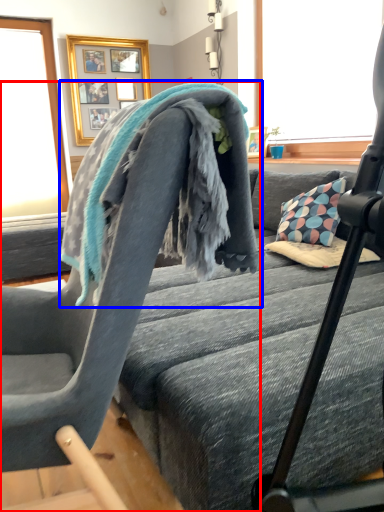
Question: Which object appears farthest to the camera in this image, chair (highlighted by a red box) or bath towel (highlighted by a blue box)?

Choices:
 (A) chair
 (B) bath towel

Answer: (B)